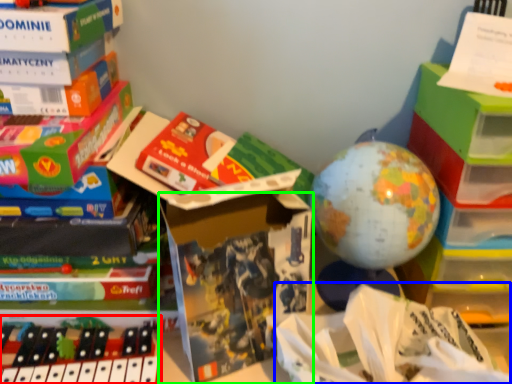
Question: Which is nearer to the toy (highlighted by a red box)? wrapping paper (highlighted by a blue box) or paperback book (highlighted by a green box).

Choices:
 (A) wrapping paper
 (B) paperback book

Answer: (B)